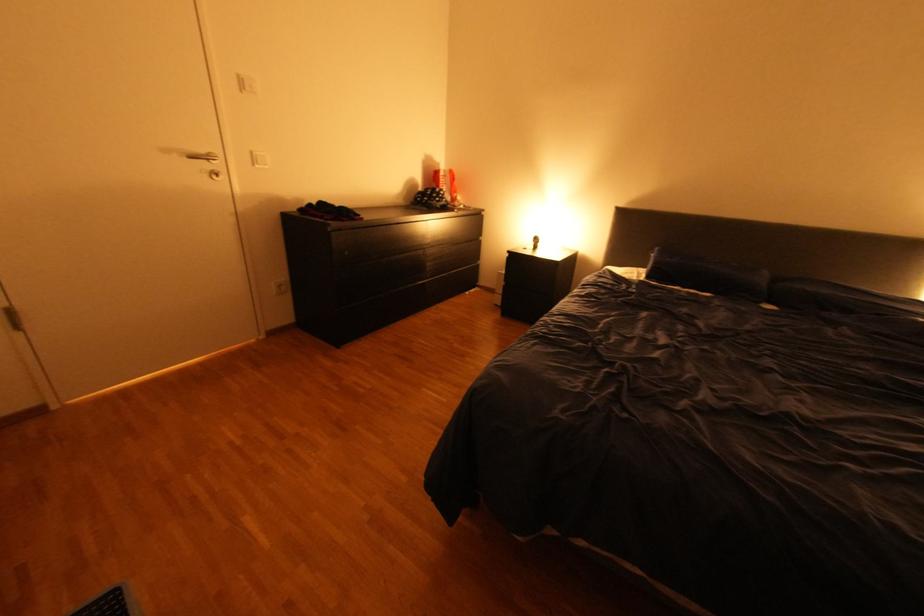
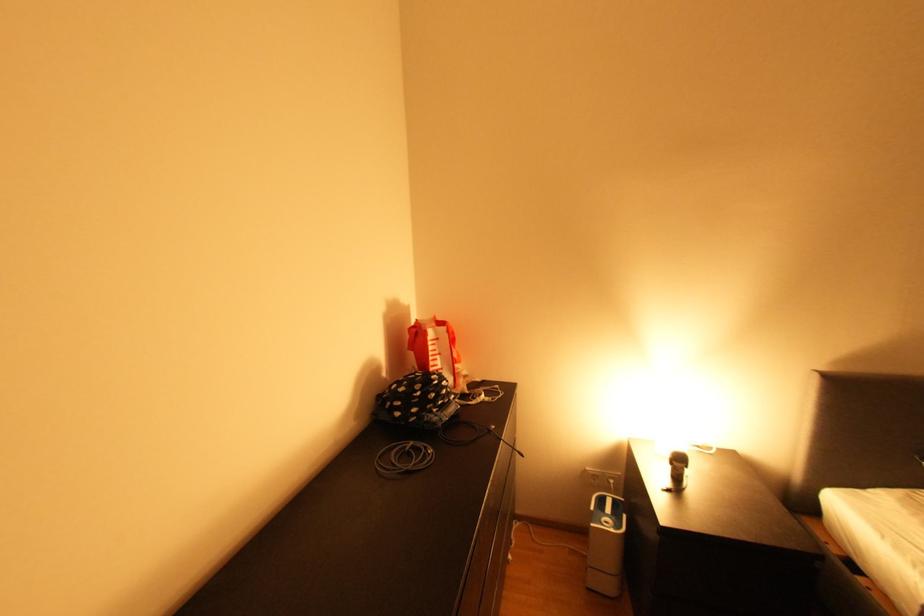
Locate, in the second image, the point that corresponds to the point at 443,201 in the first image.

(441, 411)